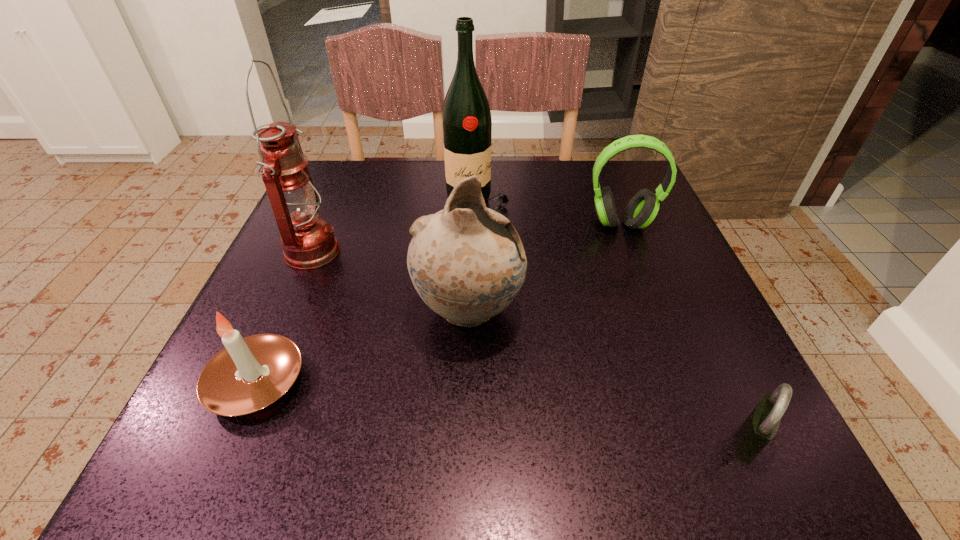
The image size is (960, 540). What are the coordinates of `free space between the candle and the padlock` in the screenshot? It's located at (503, 411).

Identify the location of empty space between the headset and the fourth shortest object. The width and height of the screenshot is (960, 540). (544, 267).

Where is `empty space between the third tallest object and the second shortest object`? Image resolution: width=960 pixels, height=540 pixels. empty space between the third tallest object and the second shortest object is located at coordinates (363, 346).

Image resolution: width=960 pixels, height=540 pixels. What are the coordinates of `free area in between the oil lamp and the fifth tallest object` in the screenshot? It's located at (284, 318).

You are a GUI agent. You are given a task and a screenshot of the screen. Output one action in this format:
    pyautogui.click(x=<x>, y=<y>)
    Task: Click on the empty space between the headset and the third tallest object
    This screenshot has height=540, width=960.
    Given the screenshot: What is the action you would take?
    pyautogui.click(x=544, y=267)

Locate an element on the screen. free spot between the fourth shortest object and the padlock is located at coordinates (609, 375).

The width and height of the screenshot is (960, 540). I want to click on object identified as the closest to the fourth tallest object, so click(466, 118).

Identify which object is the third nearest to the padlock. Please provide its 2D coordinates. Your answer should be formatted as a tuple, i.e. [(x, y)], where the tuple contains the x and y coordinates of a point satisfying the conditions above.

[(466, 118)]

This screenshot has height=540, width=960. I want to click on free spot that satisfies the following two spatial constraints: 1. on the back side of the headset; 2. on the right side of the oil lamp, so click(x=324, y=224).

The width and height of the screenshot is (960, 540). Identify the location of blank space that satisfies the following two spatial constraints: 1. from the spout of the third tallest object; 2. on the back side of the padlock. (466, 440).